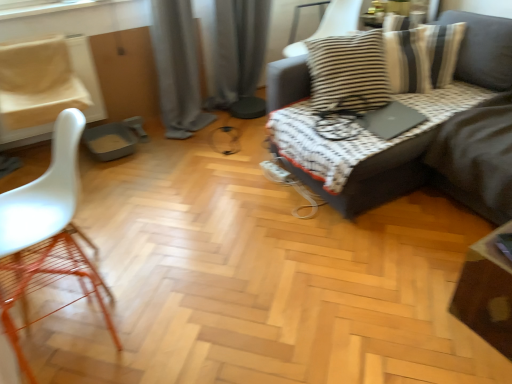
I want to click on unoccupied space behind wooden table at lower right, so [x=439, y=263].